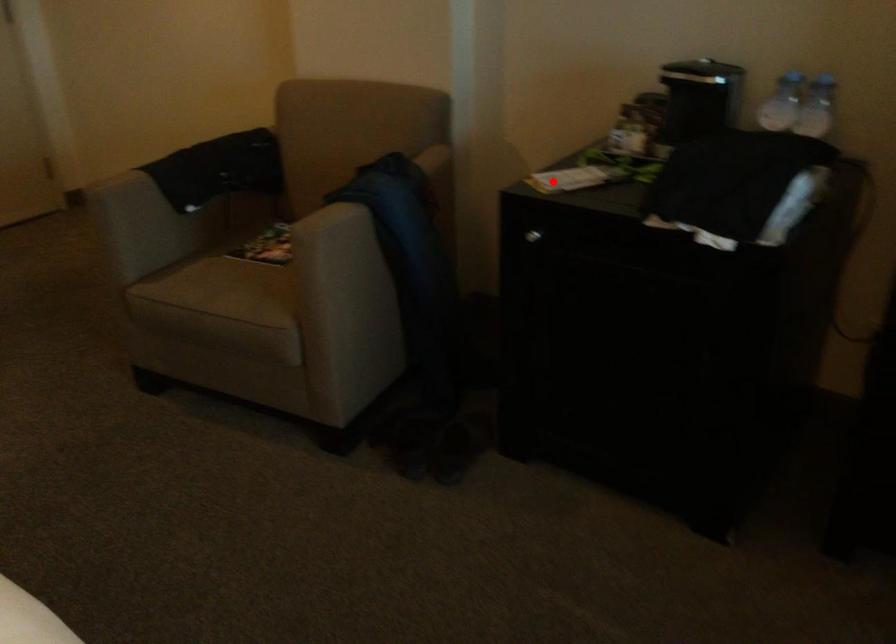
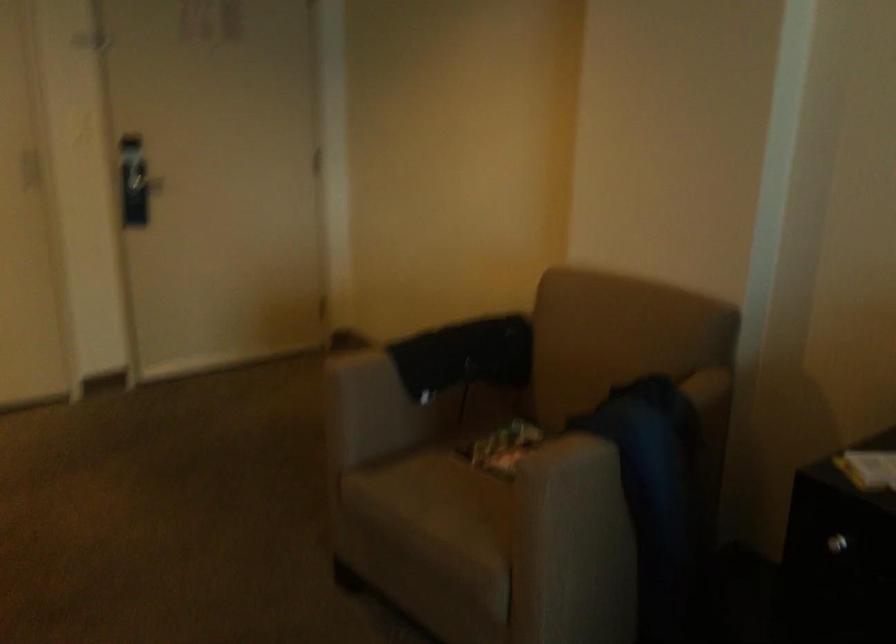
Question: I am providing you with two images of the same scene from different viewpoints. Given a red point in image1, look at the same physical point in image2. Is it:

Choices:
 (A) Closer to the viewpoint
 (B) Farther from the viewpoint

Answer: (A)